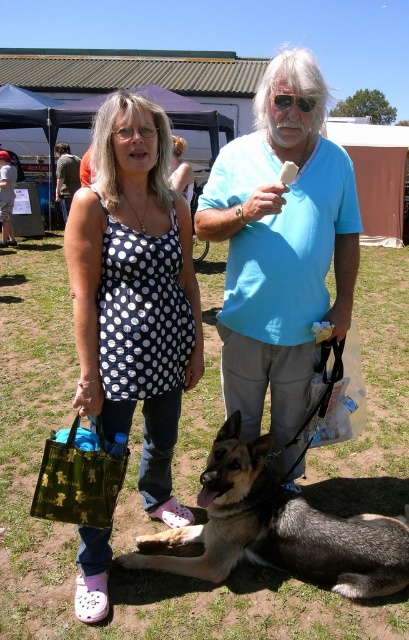
You are standing in a fairground and want to know how far the point at coordinates (341, 189) is from you. Can you determine the distance?

The distance of point (341, 189) from the viewer is 8.14 feet.

You are standing in the center of a fairground and see the blue cotton shirt at center and the brown fur dog at center. Which object is positioned to the left?

The brown fur dog at center is positioned to the left of the blue cotton shirt at center.

You are a photographer trying to capture a photo of the two people in the scene. Which clothing item, the polka dot fabric dress at center or the matte black tank top at upper left, would be more visible in your photo due to its position?

The matte black tank top at upper left is more visible because it is positioned above the polka dot fabric dress at center, making it stand out in the photo.